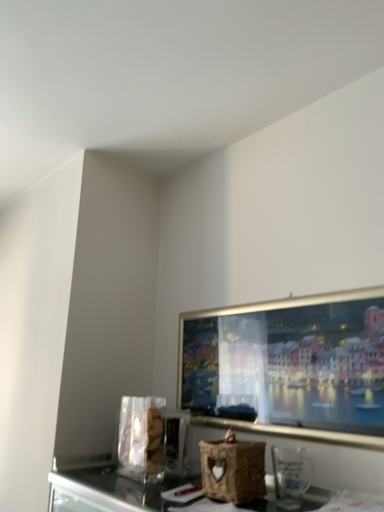
Question: From a real-world perspective, is transparent glass at lower right positioned above or below woven brown basket at center?

Choices:
 (A) below
 (B) above

Answer: (B)

Question: In the image, is transparent glass at lower right positioned in front of or behind woven brown basket at center?

Choices:
 (A) front
 (B) behind

Answer: (A)

Question: Would you say transparent glass at lower right is inside or outside woven brown basket at center?

Choices:
 (A) outside
 (B) inside

Answer: (A)

Question: Is woven brown basket at center to the left or to the right of transparent glass at lower right in the image?

Choices:
 (A) right
 (B) left

Answer: (B)

Question: Is woven brown basket at center taller or shorter than transparent glass at lower right?

Choices:
 (A) short
 (B) tall

Answer: (B)

Question: Considering their positions, is woven brown basket at center located in front of or behind transparent glass at lower right?

Choices:
 (A) behind
 (B) front

Answer: (A)

Question: Looking at their shapes, would you say woven brown basket at center is wider or thinner than transparent glass at lower right?

Choices:
 (A) wide
 (B) thin

Answer: (A)